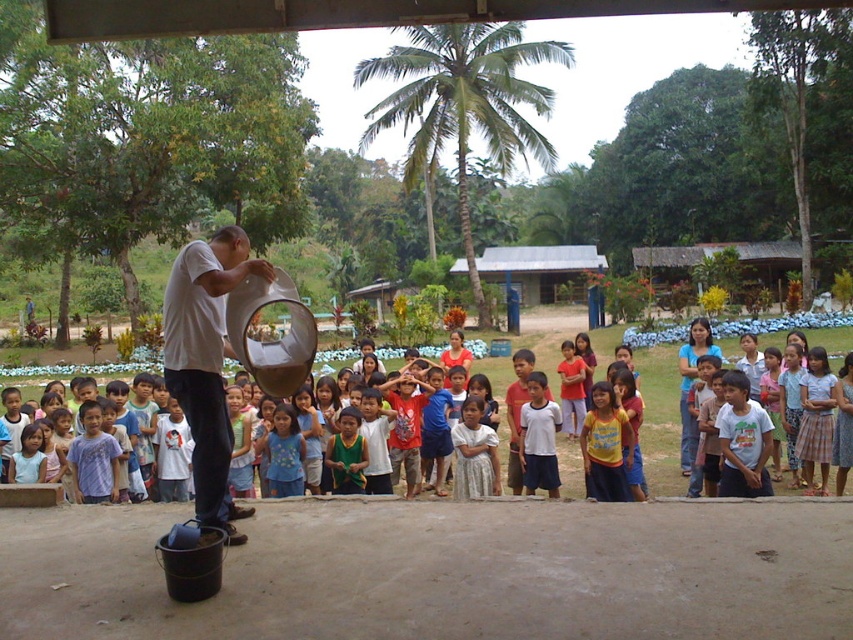
What do you see at coordinates (206, 358) in the screenshot? This screenshot has width=853, height=640. I see `white matte bucket at center` at bounding box center [206, 358].

Between white matte bucket at center and yellow cotton shirt at center, which one appears on the left side from the viewer's perspective?

white matte bucket at center

Describe the element at coordinates (206, 358) in the screenshot. I see `white matte bucket at center` at that location.

This screenshot has height=640, width=853. I want to click on white matte bucket at center, so click(206, 358).

Between yellow cotton shirt at center and white cotton shirt at center, which one appears on the right side from the viewer's perspective?

yellow cotton shirt at center is more to the right.

Is yellow cotton shirt at center behind white cotton shirt at center?

No, it is in front of white cotton shirt at center.

Between point (593, 468) and point (552, 410), which one is positioned behind?

The point (552, 410) is more distant.

Identify the location of yellow cotton shirt at center. (606, 445).

Is white matte bucket at center to the left of white cotton shirt at center from the viewer's perspective?

Correct, you'll find white matte bucket at center to the left of white cotton shirt at center.

Can you confirm if white matte bucket at center is wider than white cotton shirt at center?

Indeed, white matte bucket at center has a greater width compared to white cotton shirt at center.

Is point (210, 280) farther from camera compared to point (544, 413)?

No, (210, 280) is in front of (544, 413).

This screenshot has width=853, height=640. I want to click on white matte bucket at center, so (206, 358).